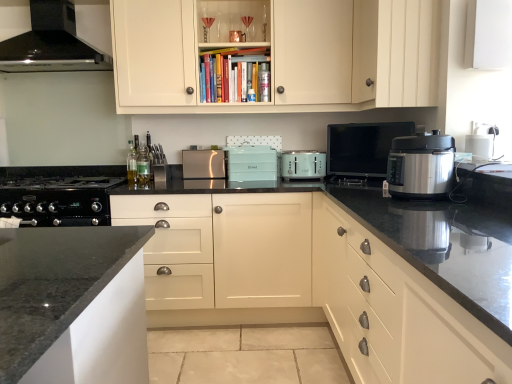
Question: Would you consider black glossy television at upper right, arranged as the fourth kitchen appliance when viewed from the back, to be distant from matte white drawers at right, positioned as the 4th cabinetry in top-to-bottom order?

Choices:
 (A) yes
 (B) no

Answer: (A)

Question: Can you confirm if black glossy television at upper right, which is counted as the 2th kitchen appliance, starting from the right, is shorter than matte white drawers at right, the second cabinetry in the bottom-to-top sequence?

Choices:
 (A) yes
 (B) no

Answer: (A)

Question: Does black glossy television at upper right, which is counted as the 2th kitchen appliance, starting from the right, appear on the right side of matte white drawers at right, the second cabinetry in the bottom-to-top sequence?

Choices:
 (A) no
 (B) yes

Answer: (A)

Question: Is black glossy television at upper right, positioned as the fourth kitchen appliance in left-to-right order, beside matte white drawers at right, the second cabinetry in the bottom-to-top sequence?

Choices:
 (A) yes
 (B) no

Answer: (B)

Question: Could you tell me if black glossy television at upper right, positioned as the fourth kitchen appliance in left-to-right order, is facing matte white drawers at right, positioned as the 4th cabinetry in top-to-bottom order?

Choices:
 (A) no
 (B) yes

Answer: (A)

Question: Can you confirm if black glossy television at upper right, the 2th kitchen appliance viewed from the front, is thinner than matte white drawers at right, positioned as the 4th cabinetry in top-to-bottom order?

Choices:
 (A) yes
 (B) no

Answer: (A)

Question: Is the position of satin silver toaster at center, positioned as the 5th kitchen appliance in front-to-back order, more distant than that of matte white cabinet at center, marked as the first cabinetry in a bottom-to-top arrangement?

Choices:
 (A) yes
 (B) no

Answer: (A)

Question: Is satin silver toaster at center, the 1th kitchen appliance in the left-to-right sequence, positioned beyond the bounds of matte white cabinet at center, marked as the first cabinetry in a bottom-to-top arrangement?

Choices:
 (A) yes
 (B) no

Answer: (A)

Question: Considering the relative sizes of satin silver toaster at center, which ranks as the fifth kitchen appliance in right-to-left order, and matte white cabinet at center, marked as the first cabinetry in a bottom-to-top arrangement, in the image provided, is satin silver toaster at center, which ranks as the fifth kitchen appliance in right-to-left order, wider than matte white cabinet at center, marked as the first cabinetry in a bottom-to-top arrangement,?

Choices:
 (A) yes
 (B) no

Answer: (B)

Question: Is satin silver toaster at center, which ranks as the fifth kitchen appliance in right-to-left order, shorter than matte white cabinet at center, which is counted as the 5th cabinetry, starting from the top?

Choices:
 (A) yes
 (B) no

Answer: (A)

Question: From a real-world perspective, is satin silver toaster at center, which ranks as the fifth kitchen appliance in right-to-left order, located beneath matte white cabinet at center, marked as the first cabinetry in a bottom-to-top arrangement?

Choices:
 (A) yes
 (B) no

Answer: (B)

Question: From the image's perspective, does satin silver toaster at center, the 1th kitchen appliance in the left-to-right sequence, appear lower than matte white cabinet at center, marked as the first cabinetry in a bottom-to-top arrangement?

Choices:
 (A) no
 (B) yes

Answer: (A)

Question: Is satin silver toaster at center, which ranks as the fifth kitchen appliance in right-to-left order, at the right side of matte white cabinet at upper center, which is the 1th cabinetry in top-to-bottom order?

Choices:
 (A) no
 (B) yes

Answer: (A)